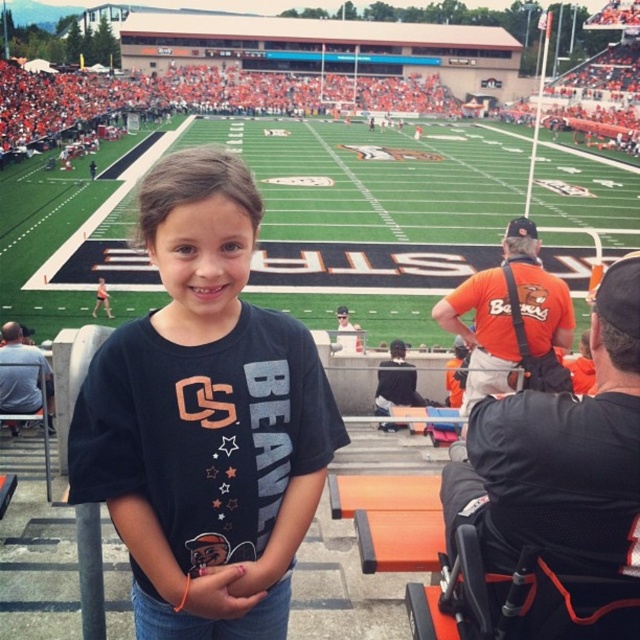
You are a photographer trying to capture a wide shot of the green turf football field at center and the orange fabric wheelchair at lower right. Considering their sizes, which object should you focus on first to ensure both are clearly visible in the frame?

The green turf football field at center is bigger than the orange fabric wheelchair at lower right, so you should focus on the green turf football field at center first to ensure both are clearly visible in the frame.

You are standing at the center of the stadium and want to walk to the green turf football field at center. Which direction should you walk to reach it?

The green turf football field at center is located at point [376,211], so you should walk towards the lower left direction to reach it.